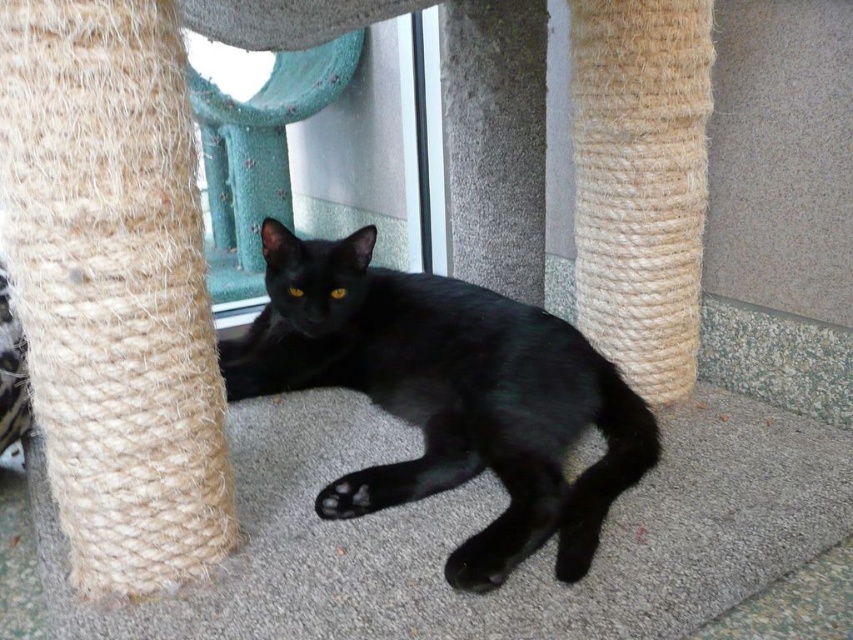
Does point (303, 268) lie behind point (440, 160)?

No, (303, 268) is closer to viewer.

Consider the image. Between black matte fur cat at center and transparent glass door at center, which one has less height?

black matte fur cat at center is shorter.

Who is more forward, (346, 275) or (323, 204)?

Point (346, 275)

What are the coordinates of `black matte fur cat at center` in the screenshot? It's located at (447, 396).